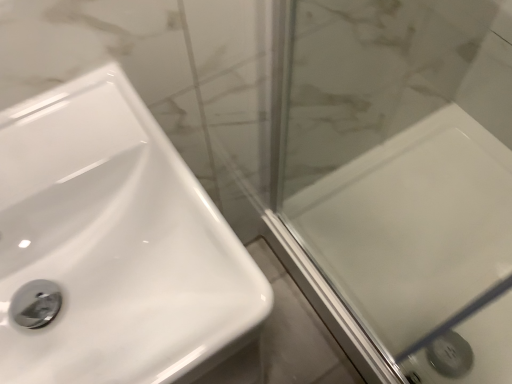
Question: Should I look upward or downward to see white glossy sink at left?

Choices:
 (A) down
 (B) up

Answer: (A)